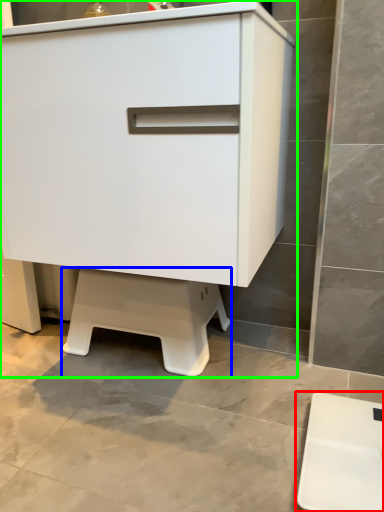
Question: Estimate the real-world distances between objects in this image. Which object is closer to furniture (highlighted by a red box), step stool (highlighted by a blue box) or chest of drawers (highlighted by a green box)?

Choices:
 (A) step stool
 (B) chest of drawers

Answer: (A)